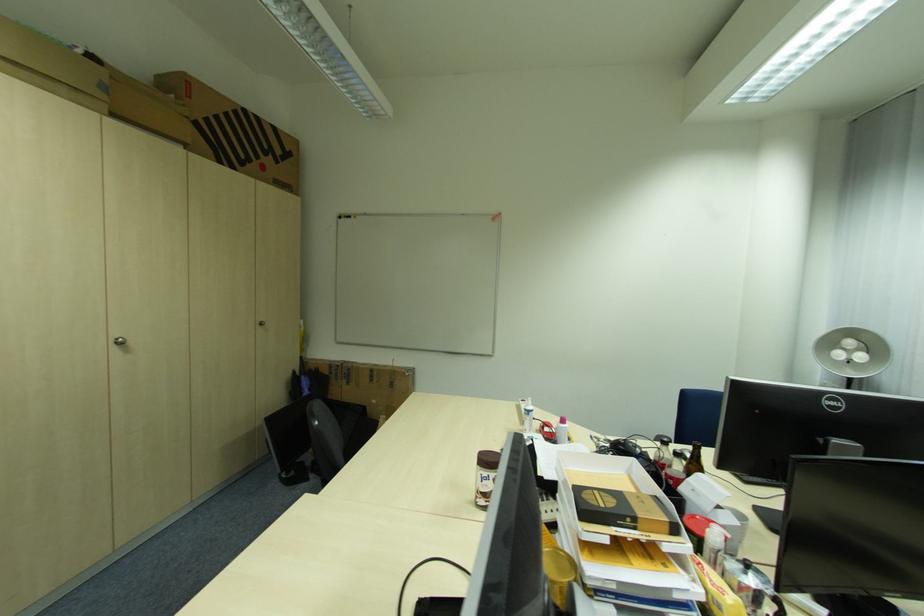
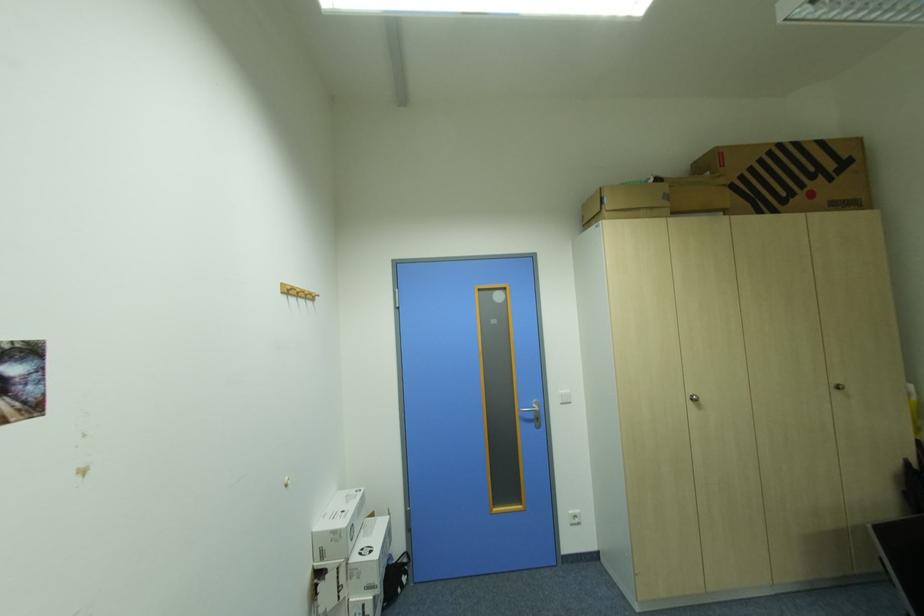
Find the pixel in the second image that matches (244,113) in the first image.

(777, 153)